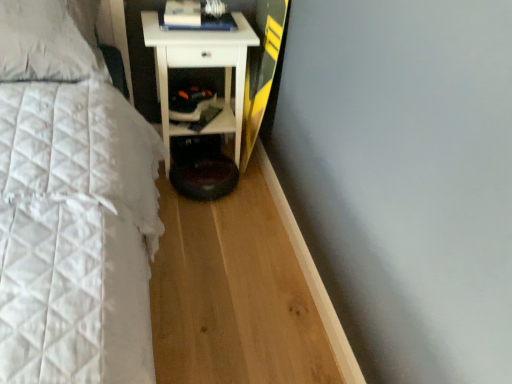
Locate an element on the screen. The image size is (512, 384). vacant region above white glossy nightstand at center (from a real-world perspective) is located at coordinates (201, 26).